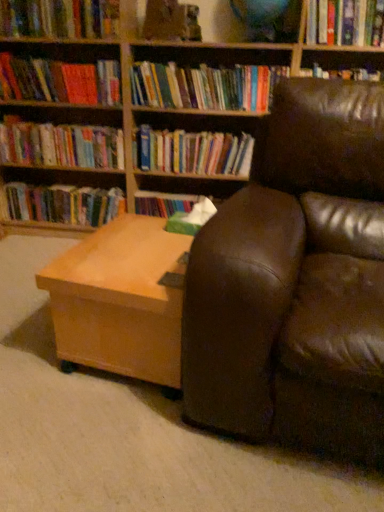
Identify the location of vacant area that is in front of light brown wood table at lower left. (126, 445).